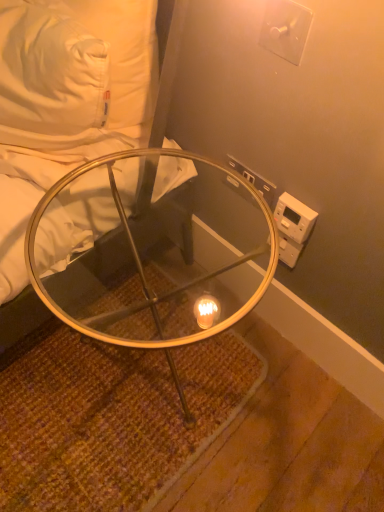
This screenshot has height=512, width=384. Find the location of `vacant space underneath clear glass table at center (from a real-world perspective)`. vacant space underneath clear glass table at center (from a real-world perspective) is located at coordinates (158, 373).